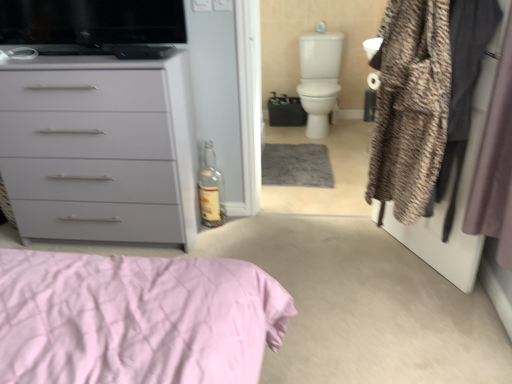
Find the location of `vacant space that's between fuzzy fabric coat at right and transparent glass bottle at center`. vacant space that's between fuzzy fabric coat at right and transparent glass bottle at center is located at coordinates (323, 241).